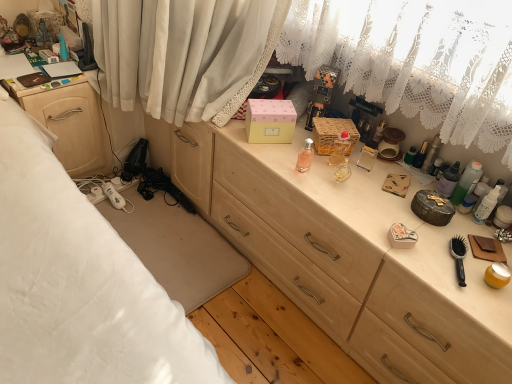
At what (x,y) coordinates should I click in order to perform the action: click on free space above matte wood nightstand at left (from a real-world perspective). Please return your answer as a coordinate pair (x, y). The height and width of the screenshot is (384, 512). Looking at the image, I should click on (40, 54).